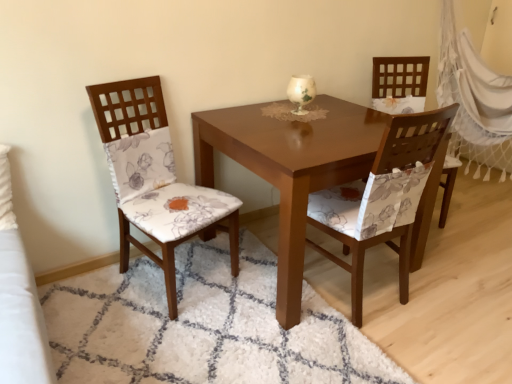
Question: Considering the relative sizes of white net curtain at right and matte floral fabric chair at center, placed as the 2th chair when sorted from left to right, in the image provided, is white net curtain at right shorter than matte floral fabric chair at center, placed as the 2th chair when sorted from left to right,?

Choices:
 (A) no
 (B) yes

Answer: (A)

Question: From the image's perspective, is white net curtain at right on top of matte floral fabric chair at center, which is the second chair in right-to-left order?

Choices:
 (A) no
 (B) yes

Answer: (B)

Question: Can you confirm if white net curtain at right is positioned to the right of matte floral fabric chair at center, placed as the 2th chair when sorted from left to right?

Choices:
 (A) yes
 (B) no

Answer: (A)

Question: From a real-world perspective, is white net curtain at right positioned over matte floral fabric chair at center, placed as the 2th chair when sorted from left to right, based on gravity?

Choices:
 (A) no
 (B) yes

Answer: (B)

Question: Is white net curtain at right at the left side of matte floral fabric chair at center, placed as the 2th chair when sorted from left to right?

Choices:
 (A) no
 (B) yes

Answer: (A)

Question: Is white net curtain at right in contact with matte floral fabric chair at center, placed as the 2th chair when sorted from left to right?

Choices:
 (A) yes
 (B) no

Answer: (B)

Question: Is white net curtain at right not inside floral fabric chair at right, placed as the 3th chair when sorted from left to right?

Choices:
 (A) no
 (B) yes

Answer: (B)

Question: Can you confirm if white net curtain at right is wider than floral fabric chair at right, which is the 1th chair from right to left?

Choices:
 (A) no
 (B) yes

Answer: (A)

Question: Is white net curtain at right shorter than floral fabric chair at right, which is the 1th chair from right to left?

Choices:
 (A) yes
 (B) no

Answer: (B)

Question: Is floral fabric chair at right, placed as the 3th chair when sorted from left to right, at the back of white net curtain at right?

Choices:
 (A) yes
 (B) no

Answer: (B)

Question: Considering the relative positions of white net curtain at right and floral fabric chair at right, which is the 1th chair from right to left, in the image provided, is white net curtain at right in front of floral fabric chair at right, which is the 1th chair from right to left,?

Choices:
 (A) yes
 (B) no

Answer: (B)

Question: Can you confirm if white net curtain at right is positioned to the right of floral fabric chair at right, which is the 1th chair from right to left?

Choices:
 (A) yes
 (B) no

Answer: (A)

Question: Considering the relative sizes of floral fabric chair at right, which is the 1th chair from right to left, and wooden chair with floral cushion at left, positioned as the first chair in left-to-right order, in the image provided, is floral fabric chair at right, which is the 1th chair from right to left, shorter than wooden chair with floral cushion at left, positioned as the first chair in left-to-right order,?

Choices:
 (A) yes
 (B) no

Answer: (B)